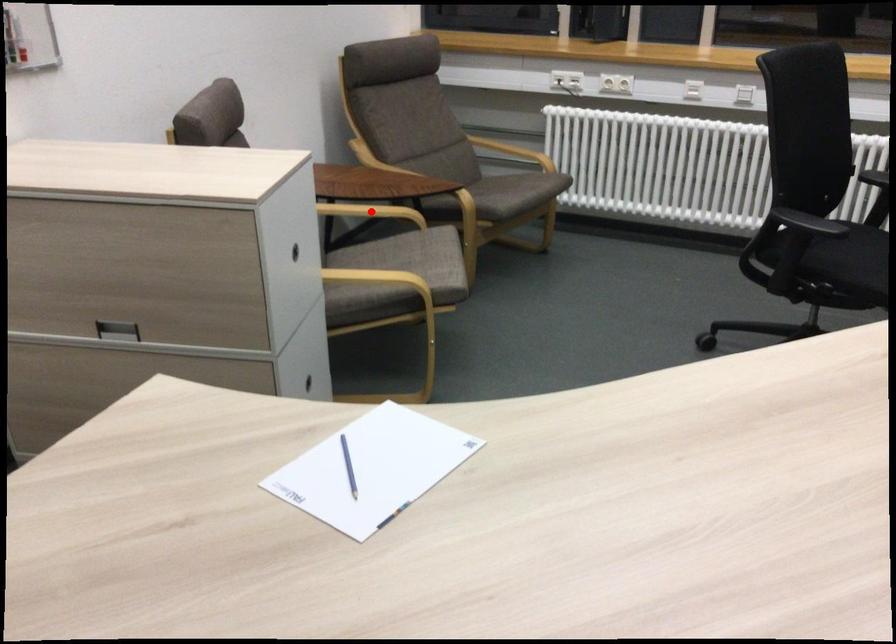
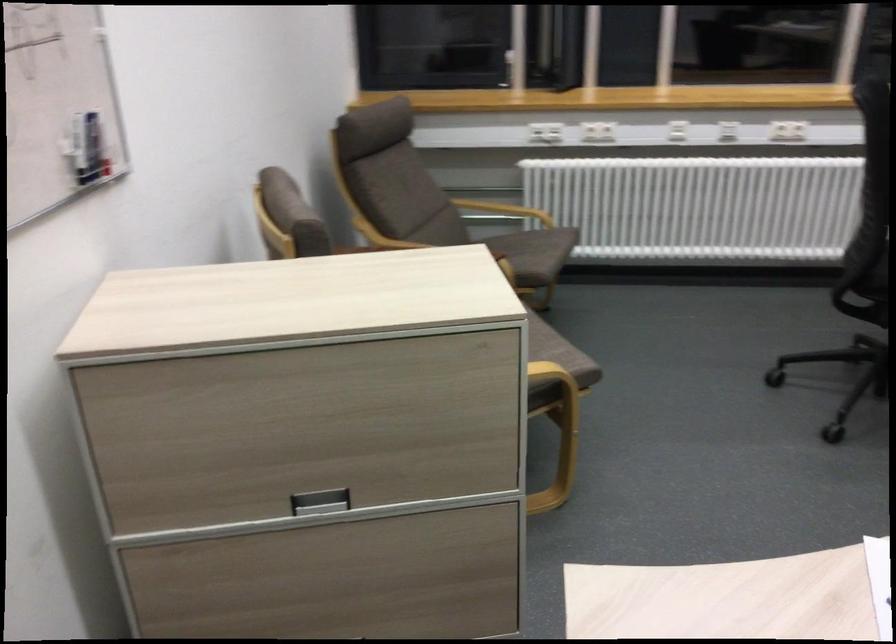
Question: I am providing you with two images of the same scene from different viewpoints. A red point is marked on the first image. Is the red point's position out of view in image 2?

Choices:
 (A) Yes
 (B) No

Answer: (A)